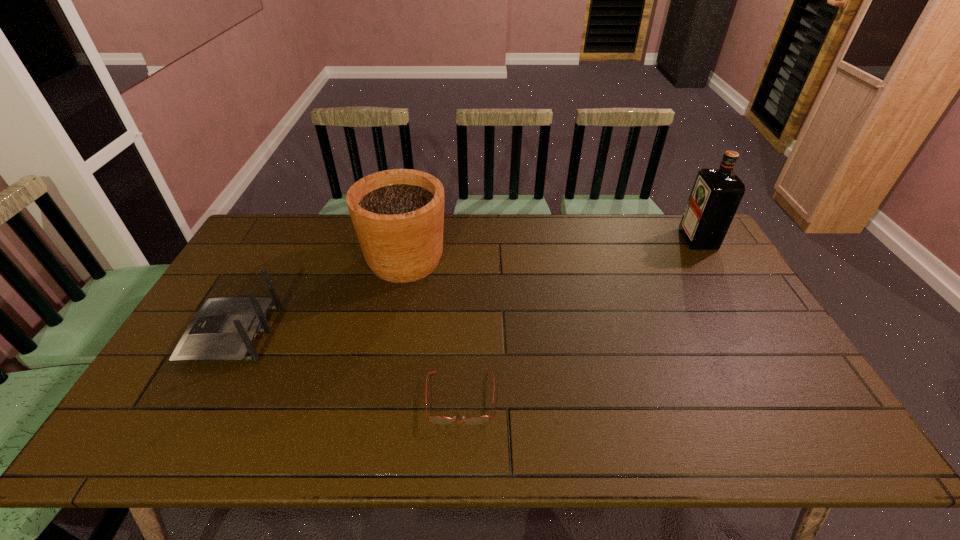
Locate an element on the screen. The height and width of the screenshot is (540, 960). the tallest object is located at coordinates (716, 194).

Find the location of a particular element. This screenshot has width=960, height=540. the rightmost object is located at coordinates (716, 194).

Image resolution: width=960 pixels, height=540 pixels. Find the location of `the third shortest object`. the third shortest object is located at coordinates (398, 215).

Locate an element on the screen. Image resolution: width=960 pixels, height=540 pixels. the third tallest object is located at coordinates (225, 329).

Locate an element on the screen. The width and height of the screenshot is (960, 540). the second nearest object is located at coordinates (225, 329).

Identify the location of the shortest object. (436, 419).

You are a GUI agent. You are given a task and a screenshot of the screen. Output one action in this format:
    pyautogui.click(x=<x>, y=<y>)
    Task: Click on the nearest object
    The height and width of the screenshot is (540, 960).
    Given the screenshot: What is the action you would take?
    pyautogui.click(x=436, y=419)

The image size is (960, 540). Find the location of `free spot located 0.130m on the front label of the rightmost object`. free spot located 0.130m on the front label of the rightmost object is located at coordinates click(647, 239).

At what (x,y) coordinates should I click in order to perform the action: click on blank area located on the front label of the rightmost object. Please return your answer as a coordinate pair (x, y). Looking at the image, I should click on (636, 239).

Identify the location of vacant region located on the front label of the rightmost object. The image size is (960, 540). (653, 239).